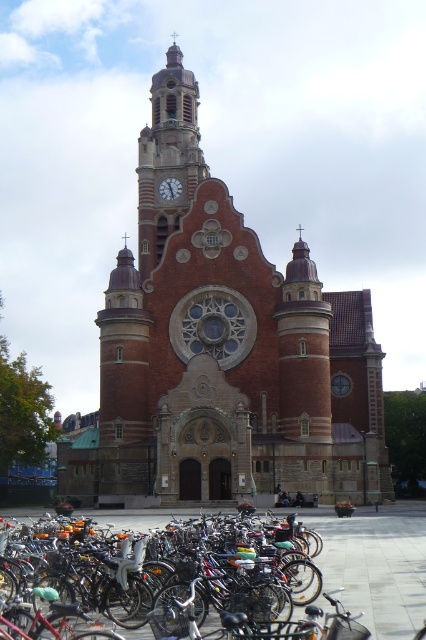
Consider the image. Is red brick church at center thinner than brick clock tower at center?

No, red brick church at center is not thinner than brick clock tower at center.

In the scene shown: Is red brick church at center smaller than brick clock tower at center?

No.

Who is more distant from viewer, (192, 362) or (192, 182)?

The point (192, 182) is behind.

Identify the location of red brick church at center. (221, 352).

Which is behind, point (213, 364) or point (203, 557)?

The point (213, 364) is behind.

Which of these two, red brick church at center or shiny metallic bicycle at lower left, stands taller?

red brick church at center

This screenshot has width=426, height=640. I want to click on red brick church at center, so click(221, 352).

Can you confirm if shiny metallic bicycle at lower left is positioned to the right of brick clock tower at center?

Yes, shiny metallic bicycle at lower left is to the right of brick clock tower at center.

Does shiny metallic bicycle at lower left have a greater height compared to brick clock tower at center?

No.

Does point (196, 625) lie behind point (204, 172)?

No, it is in front of (204, 172).

Find the location of a particular element. Image resolution: width=426 pixels, height=640 pixels. shiny metallic bicycle at lower left is located at coordinates (175, 584).